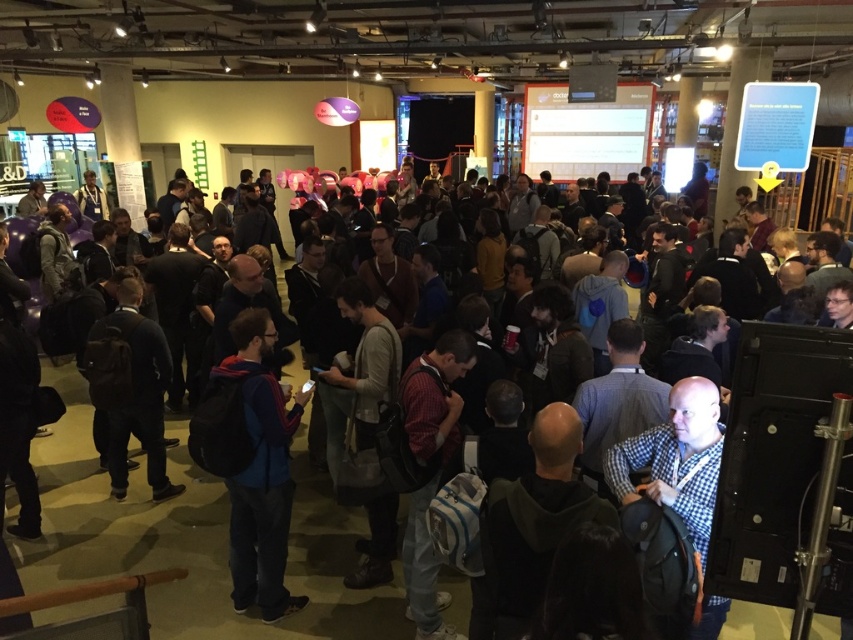
You are at the event and want to find the person wearing the checkered fabric shirt at center. Which direction should you look relative to the blue fleece jacket at center?

The blue fleece jacket at center is positioned on the left side of the checkered fabric shirt at center, so to find the checkered fabric shirt at center, you should look to the right of the blue fleece jacket at center.

You are standing at the entrance of the conference hall and notice a blue fleece jacket at center. If you walk straight ahead, will the jacket be in your path?

The blue fleece jacket at center is at point [251,461], which is likely in your path if you walk straight ahead from the entrance.

You are organizing a photo shoot and need to position the dark blue backpack at center and the checkered fabric shirt at center so that both are visible in the frame. Given their sizes, which object should you place closer to the camera to ensure both are fully visible?

The dark blue backpack at center has a lesser height compared to checkered fabric shirt at center, so you should place the checkered fabric shirt at center closer to the camera to ensure both objects are fully visible in the frame.